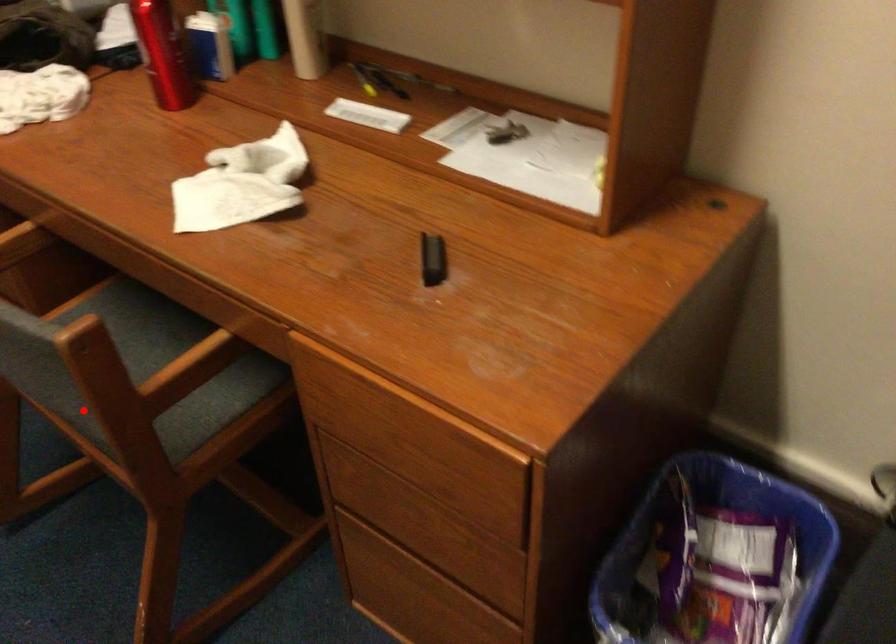
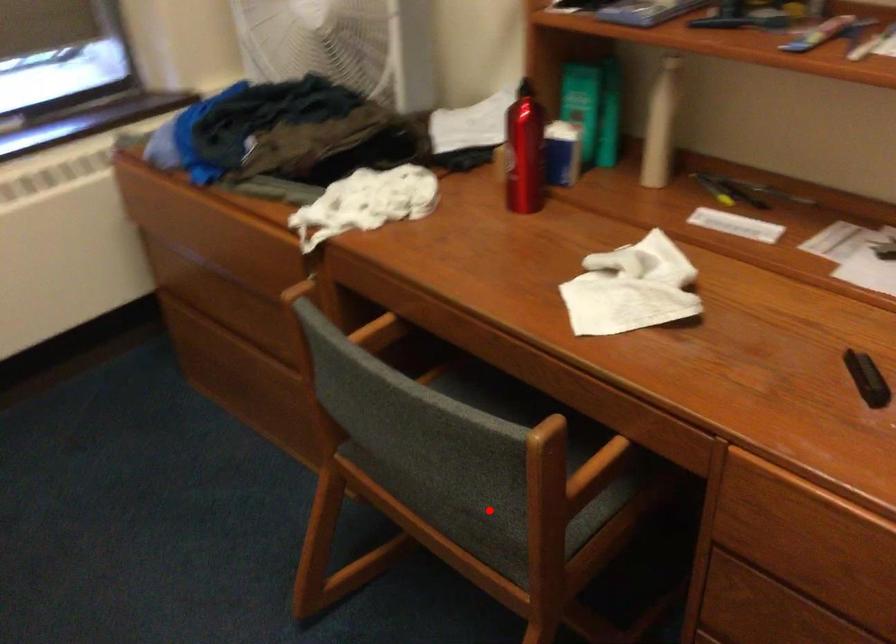
I am providing you with two images of the same scene from different viewpoints. A red point is marked on the first image and another point is marked on the second image. Is the marked point in image1 the same physical position as the marked point in image2?

Yes